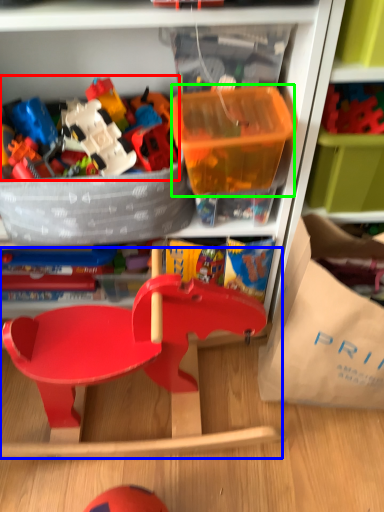
Question: Based on their relative distances, which object is farther from toy (highlighted by a red box)? Choose from baby carriage (highlighted by a blue box) and storage box (highlighted by a green box).

Choices:
 (A) baby carriage
 (B) storage box

Answer: (A)